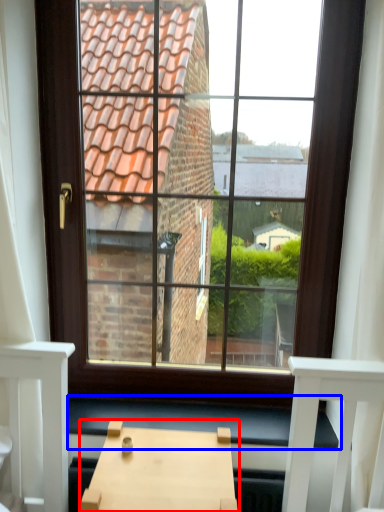
Question: Which object appears closest to the camera in this image, table (highlighted by a red box) or window sill (highlighted by a blue box)?

Choices:
 (A) table
 (B) window sill

Answer: (A)